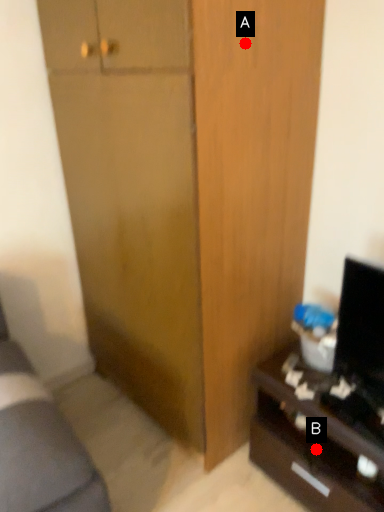
Question: Two points are circled on the image, labeled by A and B beside each circle. Among these points, which one is farthest from the camera?

Choices:
 (A) A is further
 (B) B is further

Answer: (B)